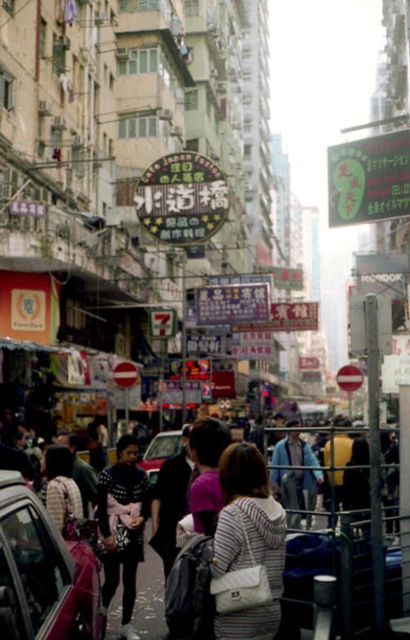
Does metallic red car at lower left have a greater width compared to white quilted purse at center?

Yes, metallic red car at lower left is wider than white quilted purse at center.

Does metallic red car at lower left have a larger size compared to white quilted purse at center?

Indeed, metallic red car at lower left has a larger size compared to white quilted purse at center.

Which is behind, point (38, 556) or point (241, 566)?

Point (241, 566)

Find the location of a particular element. The height and width of the screenshot is (640, 410). metallic red car at lower left is located at coordinates (43, 572).

Can you confirm if white quilted purse at center is positioned to the left of metallic silver car at center?

No, white quilted purse at center is not to the left of metallic silver car at center.

Does point (234, 512) come closer to viewer compared to point (148, 445)?

Yes.

Who is more distant from viewer, (241, 556) or (150, 477)?

Point (150, 477)

You are a GUI agent. You are given a task and a screenshot of the screen. Output one action in this format:
    pyautogui.click(x=<x>, y=<y>)
    Task: Click on the white quilted purse at center
    
    Given the screenshot: What is the action you would take?
    pyautogui.click(x=248, y=540)

Is striped fabric crowd at center wider than white quilted purse at center?

Indeed, striped fabric crowd at center has a greater width compared to white quilted purse at center.

Based on the photo, is striped fabric crowd at center below white quilted purse at center?

Correct, striped fabric crowd at center is located below white quilted purse at center.

Image resolution: width=410 pixels, height=640 pixels. I want to click on striped fabric crowd at center, so click(x=41, y=572).

Locate an element on the screen. This screenshot has height=640, width=410. striped fabric crowd at center is located at coordinates (41, 572).